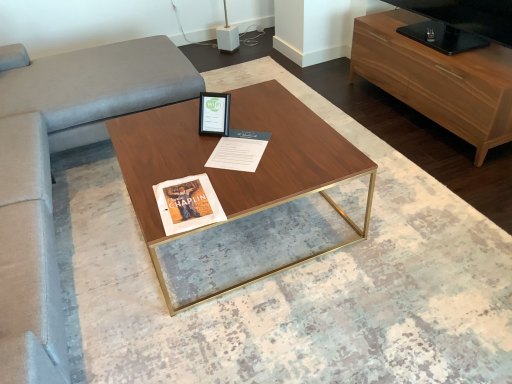
Find the location of `unoccupied region to the right of walnut wood coffee table at center`. unoccupied region to the right of walnut wood coffee table at center is located at coordinates (406, 224).